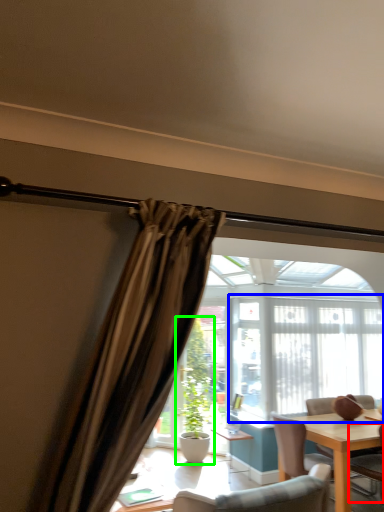
Question: Considering the real-world distances, which object is farthest from chair (highlighted by a red box)? window frame (highlighted by a blue box) or houseplant (highlighted by a green box)?

Choices:
 (A) window frame
 (B) houseplant

Answer: (B)